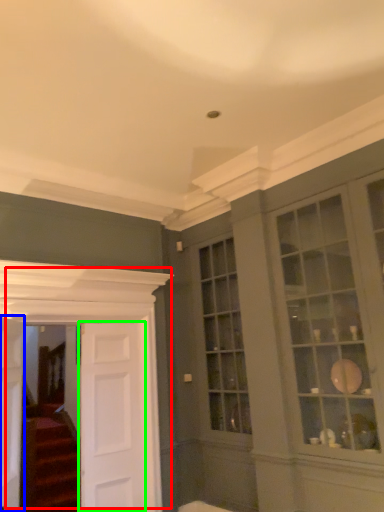
Question: Considering the real-world distances, which object is farthest from door (highlighted by a red box)? door (highlighted by a blue box) or door (highlighted by a green box)?

Choices:
 (A) door
 (B) door

Answer: (A)